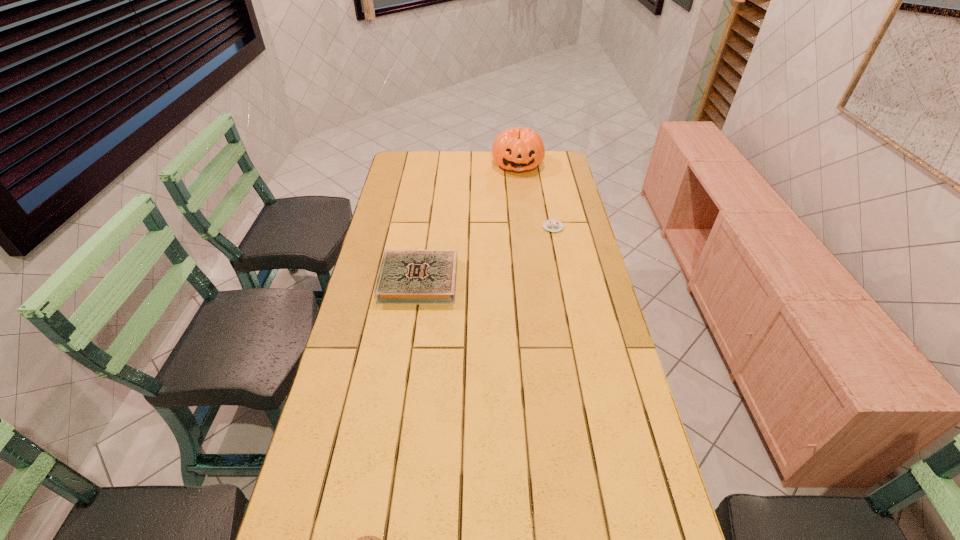
This screenshot has width=960, height=540. What are the coordinates of `object that stands as the third closest to the tallest object` in the screenshot? It's located at (370, 539).

The image size is (960, 540). In order to click on free point that satisfies the following two spatial constraints: 1. on the carved face of the cupcake; 2. on the left side of the farthest object in this screenshot , I will do `click(525, 227)`.